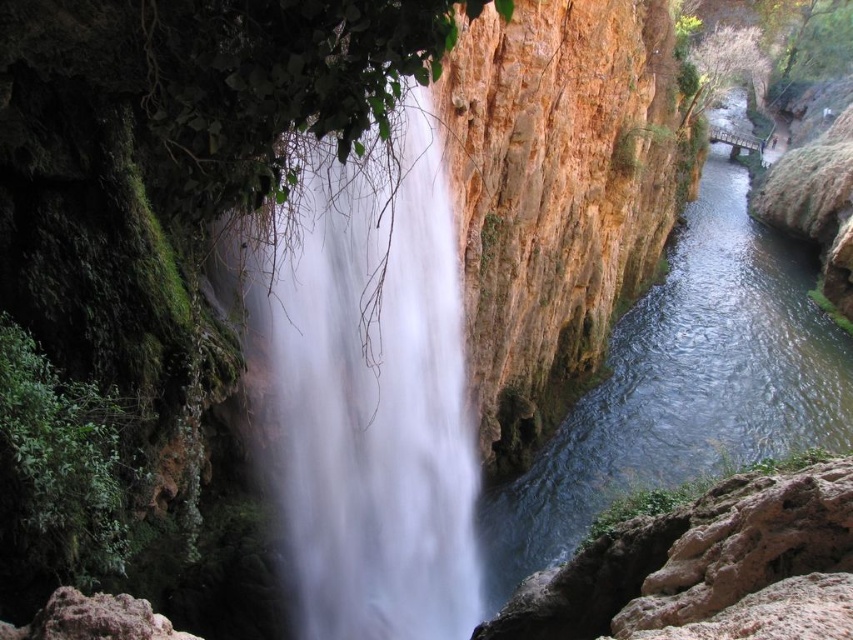
Image resolution: width=853 pixels, height=640 pixels. In order to click on white smooth waterfall at center in this screenshot , I will do [370, 404].

Does point (381, 532) lie in front of point (628, 404)?

Yes, it is.

Image resolution: width=853 pixels, height=640 pixels. I want to click on white smooth waterfall at center, so click(370, 404).

Does point (689, 204) lie behind point (149, 625)?

Yes, it is behind point (149, 625).

Which is more to the left, clear water at center right or brown rough rock at lower left?

From the viewer's perspective, brown rough rock at lower left appears more on the left side.

Where is `clear water at center right`? This screenshot has width=853, height=640. clear water at center right is located at coordinates (683, 385).

The image size is (853, 640). Find the location of `clear water at center right`. clear water at center right is located at coordinates (683, 385).

Which is more to the right, white smooth waterfall at center or brown rough rock at lower left?

From the viewer's perspective, white smooth waterfall at center appears more on the right side.

Between point (328, 340) and point (45, 636), which one is positioned behind?

Positioned behind is point (328, 340).

Where is `white smooth waterfall at center`? white smooth waterfall at center is located at coordinates (370, 404).